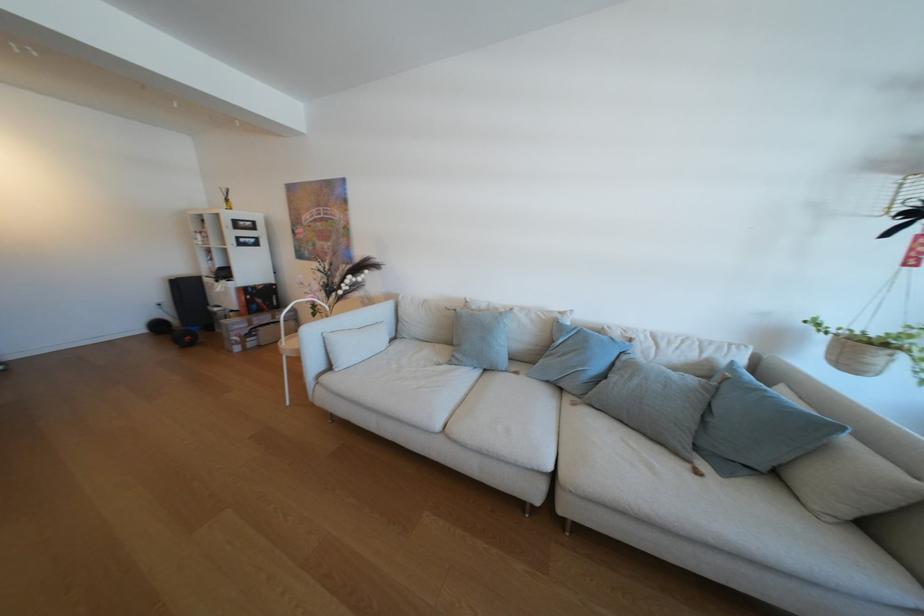
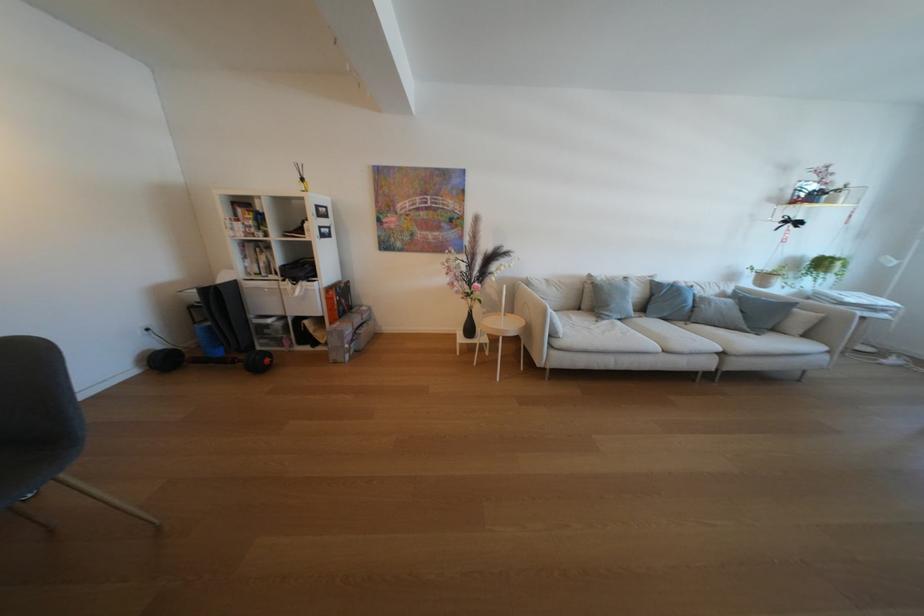
In the second image, find the point that corresponds to (x=735, y=363) in the first image.

(739, 292)